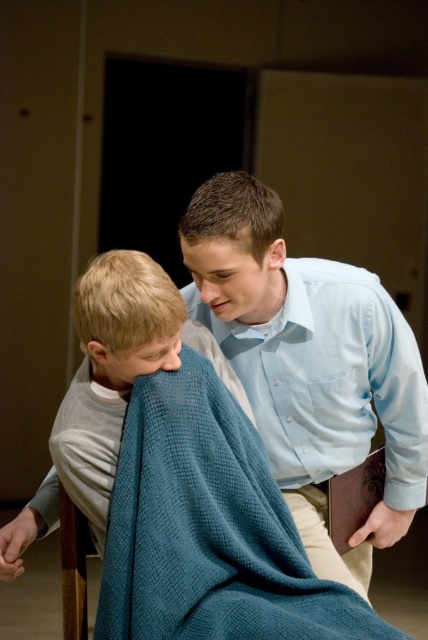
Question: Can you confirm if blue waffle-textured blanket at lower left is positioned above light blue cotton shirt at upper center?

Choices:
 (A) no
 (B) yes

Answer: (A)

Question: Does light blue cotton shirt at upper center appear over light blue textured blanket at lower left?

Choices:
 (A) no
 (B) yes

Answer: (B)

Question: Which of the following is the farthest from the observer?

Choices:
 (A) blue waffle-textured blanket at lower left
 (B) light blue shirt at center
 (C) wooden chair at lower left

Answer: (C)

Question: Which point is farther to the camera?

Choices:
 (A) light blue cotton shirt at upper center
 (B) wooden chair at lower left
 (C) light blue textured blanket at lower left
 (D) blue waffle-textured blanket at lower left

Answer: (A)

Question: Does blue waffle-textured blanket at lower left appear under light blue textured blanket at lower left?

Choices:
 (A) yes
 (B) no

Answer: (A)

Question: Which of the following is the closest to the observer?

Choices:
 (A) (360, 456)
 (B) (6, 548)
 (C) (359, 356)
 (D) (303, 620)

Answer: (D)